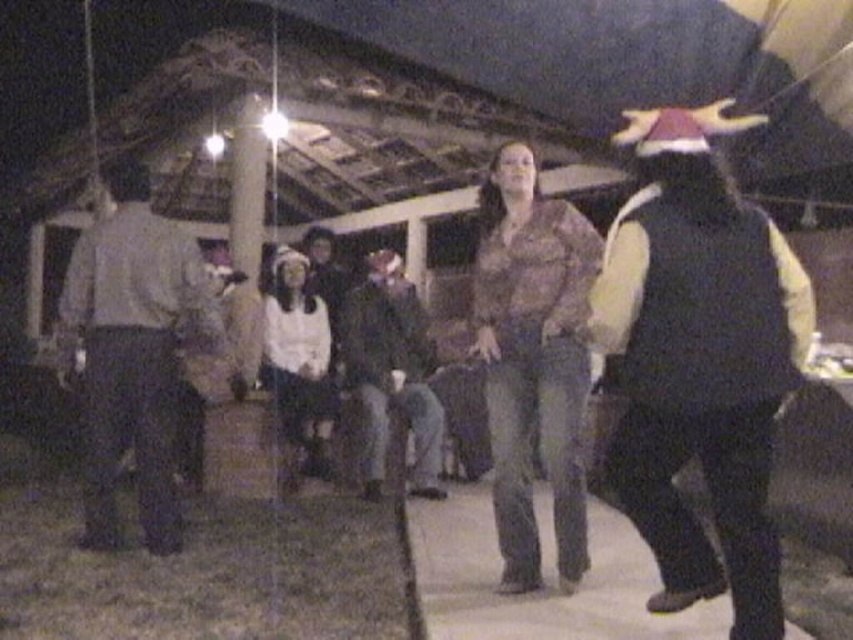
You are a photographer at the event and want to capture both the dark gray vest at right and the light brown leather jacket at left in the same frame. Your camera has a maximum focus range of 2.5 meters. Can you fit both subjects into the frame without moving closer?

The dark gray vest at right and the light brown leather jacket at left are 2.58 meters apart from each other. Since the distance exceeds the camera maximum focus range of 2.5 meters, you cannot fit both subjects into the frame without moving closer.

You are at a nighttime gathering and want to approach the person wearing the dark gray vest at right and the dark gray jeans at center. Which one should you walk towards if you are currently standing to the left of both?

Since the dark gray vest at right is to the right of the dark gray jeans at center, you should walk towards the dark gray vest at right because it is farther to the right compared to the dark gray jeans at center.